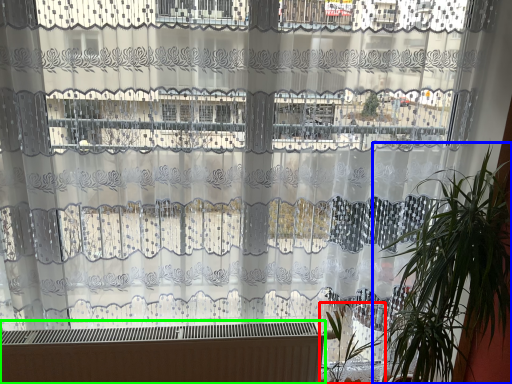
Question: Which is farther away from vegetation (highlighted by a red box)? houseplant (highlighted by a blue box) or heater (highlighted by a green box)?

Choices:
 (A) houseplant
 (B) heater

Answer: (B)